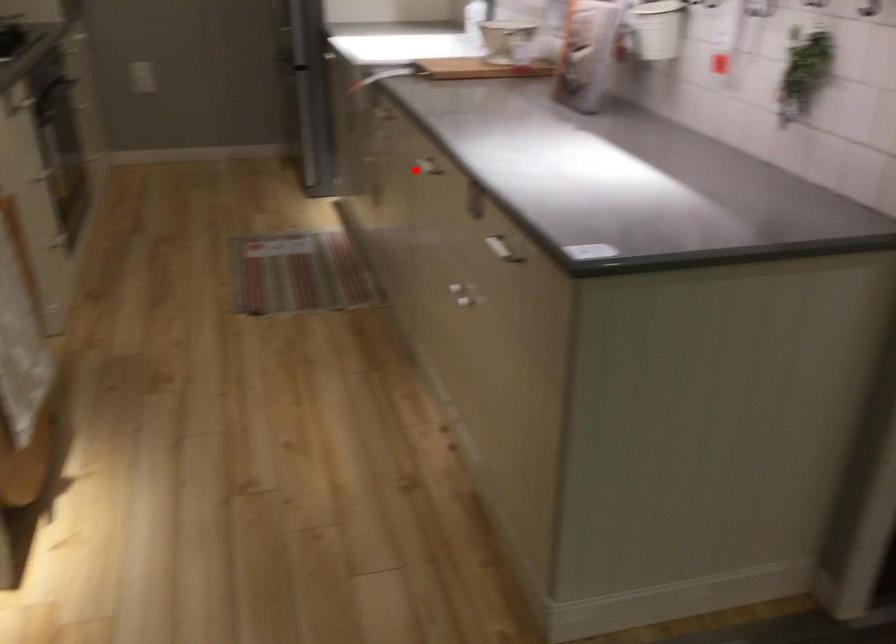
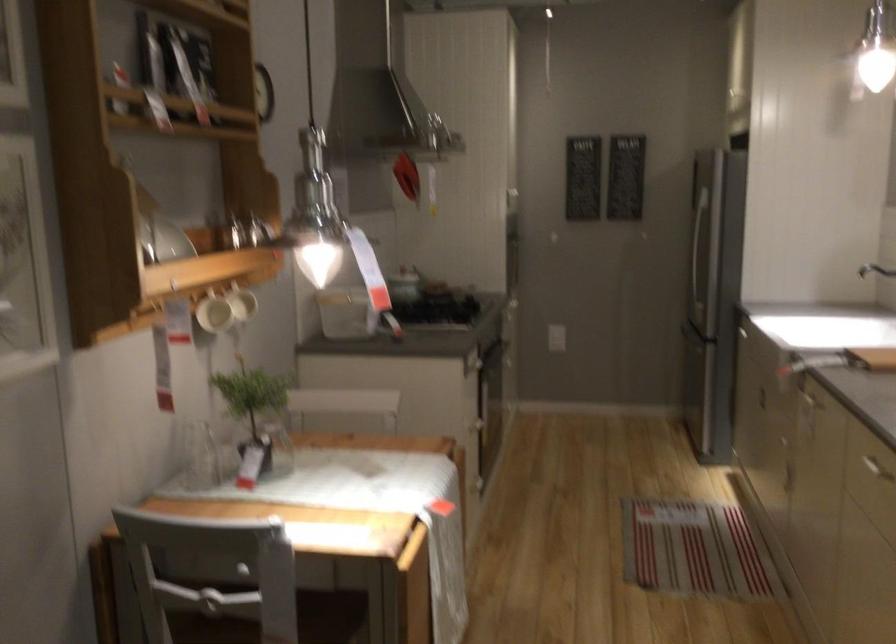
In the second image, find the point that corresponds to the highlighted location in the first image.

(872, 467)